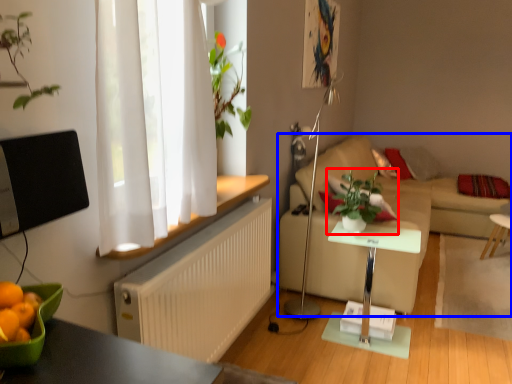
Question: Which of the following is the farthest to the observer, houseplant (highlighted by a red box) or studio couch (highlighted by a blue box)?

Choices:
 (A) houseplant
 (B) studio couch

Answer: (A)